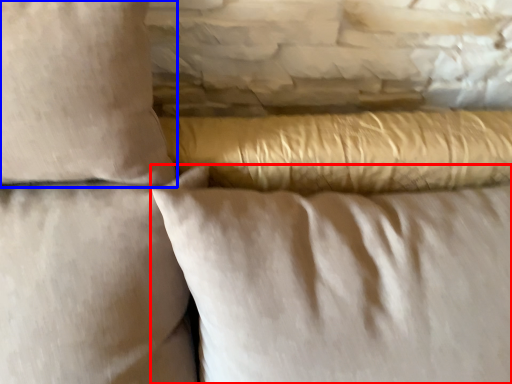
Question: Which object is closer to the camera taking this photo, pillow (highlighted by a red box) or pillow (highlighted by a blue box)?

Choices:
 (A) pillow
 (B) pillow

Answer: (B)